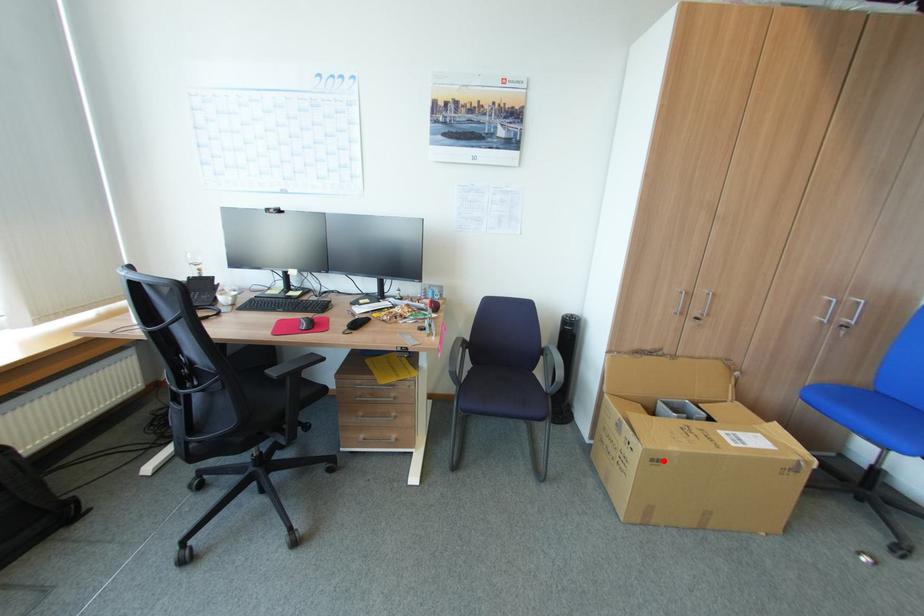
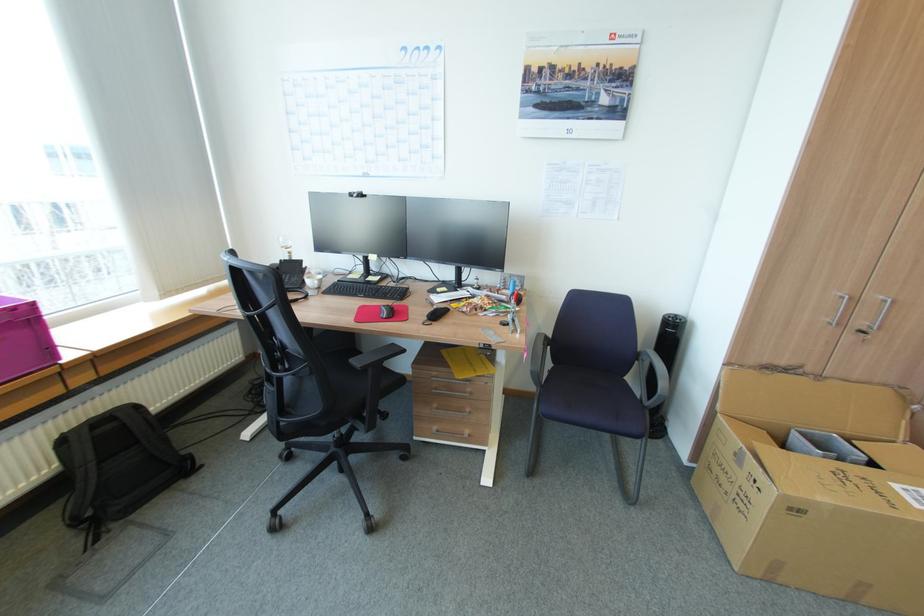
Where in the second image is the point corresponding to the highlighted location from the first image?

(804, 511)